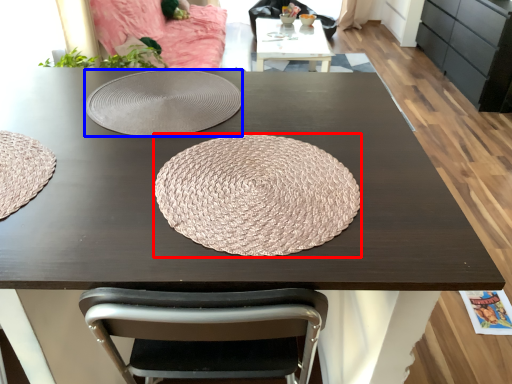
Question: Which object is further to the camera taking this photo, mat (highlighted by a red box) or plate (highlighted by a blue box)?

Choices:
 (A) mat
 (B) plate

Answer: (B)